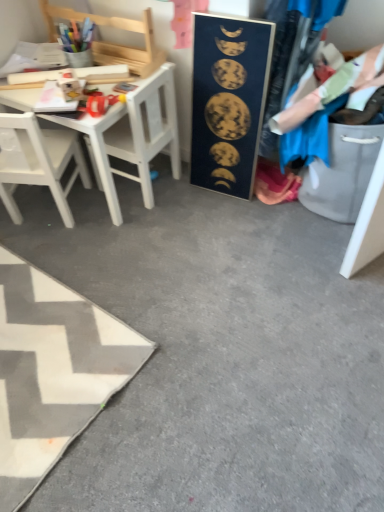
Question: Can you confirm if white matte chair at left is wider than white fabric rug at lower left?

Choices:
 (A) yes
 (B) no

Answer: (B)

Question: Would you consider white matte chair at left to be distant from white fabric rug at lower left?

Choices:
 (A) yes
 (B) no

Answer: (B)

Question: Is white matte chair at left surrounding white fabric rug at lower left?

Choices:
 (A) yes
 (B) no

Answer: (B)

Question: Considering the relative sizes of white matte chair at left and white fabric rug at lower left in the image provided, is white matte chair at left shorter than white fabric rug at lower left?

Choices:
 (A) yes
 (B) no

Answer: (B)

Question: Is white matte chair at left to the right of white fabric rug at lower left from the viewer's perspective?

Choices:
 (A) no
 (B) yes

Answer: (B)

Question: From a real-world perspective, is white matte chair at left located higher than white fabric rug at lower left?

Choices:
 (A) yes
 (B) no

Answer: (A)

Question: Is wooden chair at upper left, the 1th chair in the top-to-bottom sequence, closer to the viewer compared to dark blue matte poster at center?

Choices:
 (A) yes
 (B) no

Answer: (B)

Question: Is dark blue matte poster at center at the back of wooden chair at upper left, the 2th chair when ordered from bottom to top?

Choices:
 (A) no
 (B) yes

Answer: (A)

Question: Could you tell me if wooden chair at upper left, the 2th chair when ordered from bottom to top, is turned towards dark blue matte poster at center?

Choices:
 (A) no
 (B) yes

Answer: (A)

Question: Considering the relative sizes of wooden chair at upper left, the 1th chair in the top-to-bottom sequence, and dark blue matte poster at center in the image provided, is wooden chair at upper left, the 1th chair in the top-to-bottom sequence, smaller than dark blue matte poster at center?

Choices:
 (A) no
 (B) yes

Answer: (B)

Question: Considering the relative positions of wooden chair at upper left, the 2th chair when ordered from bottom to top, and dark blue matte poster at center in the image provided, is wooden chair at upper left, the 2th chair when ordered from bottom to top, to the right of dark blue matte poster at center from the viewer's perspective?

Choices:
 (A) yes
 (B) no

Answer: (B)

Question: Is wooden chair at upper left, the 2th chair when ordered from bottom to top, touching dark blue matte poster at center?

Choices:
 (A) yes
 (B) no

Answer: (B)

Question: Considering the relative sizes of white matte chair at left and wooden chair at upper left, the 1th chair in the top-to-bottom sequence, in the image provided, is white matte chair at left shorter than wooden chair at upper left, the 1th chair in the top-to-bottom sequence,?

Choices:
 (A) no
 (B) yes

Answer: (A)